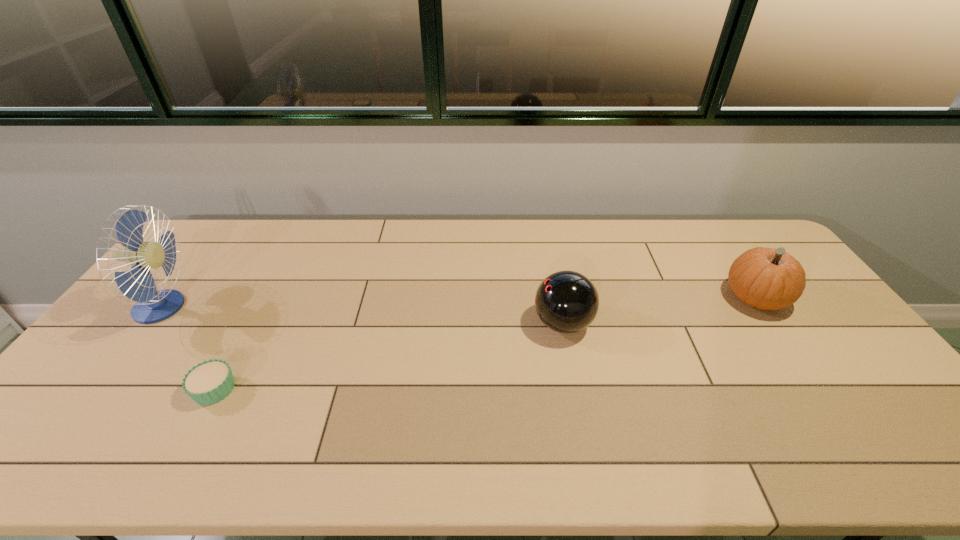
The image size is (960, 540). Identify the location of free spot at the right edge of the desktop. click(x=873, y=371).

In order to click on free space at the far left corner of the desktop in this screenshot , I will do `click(199, 231)`.

At what (x,y) coordinates should I click in order to perform the action: click on vacant region at the near left corner of the desktop. Please return your answer as a coordinate pair (x, y). This screenshot has width=960, height=540. Looking at the image, I should click on (74, 451).

The image size is (960, 540). Identify the location of vacant region between the third object from right to left and the leftmost object. (188, 348).

In order to click on vacant space in between the fan and the third object from left to right in this screenshot , I will do `click(363, 315)`.

Where is `vacant space in between the bowling ball and the third object from right to left`? This screenshot has height=540, width=960. vacant space in between the bowling ball and the third object from right to left is located at coordinates pyautogui.click(x=389, y=356).

You are a GUI agent. You are given a task and a screenshot of the screen. Output one action in this format:
    pyautogui.click(x=<x>, y=<y>)
    Task: Click on the free space that is in between the second shortest object and the tallest object
    
    Given the screenshot: What is the action you would take?
    pyautogui.click(x=363, y=315)

Locate an element on the screen. The width and height of the screenshot is (960, 540). unoccupied position between the second object from right to left and the cupcake is located at coordinates (389, 356).

At what (x,y) coordinates should I click in order to perform the action: click on vacant space that is in between the third object from left to right and the tallest object. Please return your answer as a coordinate pair (x, y). Looking at the image, I should click on (363, 315).

You are a GUI agent. You are given a task and a screenshot of the screen. Output one action in this format:
    pyautogui.click(x=<x>, y=<y>)
    Task: Click on the free point between the fan and the rightmost object
    Image resolution: width=960 pixels, height=540 pixels.
    Given the screenshot: What is the action you would take?
    pyautogui.click(x=459, y=303)